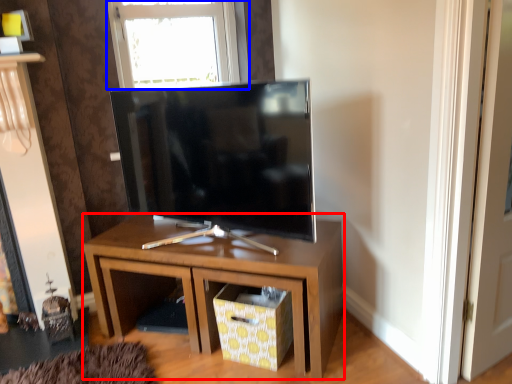
Question: Among these objects, which one is farthest to the camera, nightstand (highlighted by a red box) or window (highlighted by a blue box)?

Choices:
 (A) nightstand
 (B) window

Answer: (B)